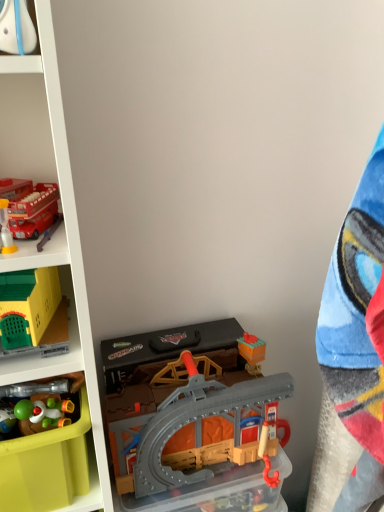
The height and width of the screenshot is (512, 384). I want to click on vacant space underneath plastic/grey track at lower center, positioned as the 5th toy in left-to-right order (from a real-world perspective), so click(x=206, y=488).